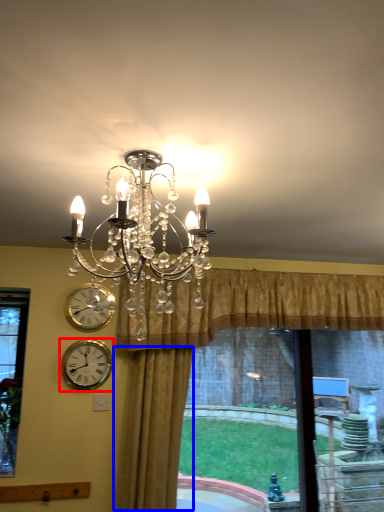
Question: Which object appears closest to the camera in this image, wall clock (highlighted by a red box) or curtain (highlighted by a blue box)?

Choices:
 (A) wall clock
 (B) curtain

Answer: (B)